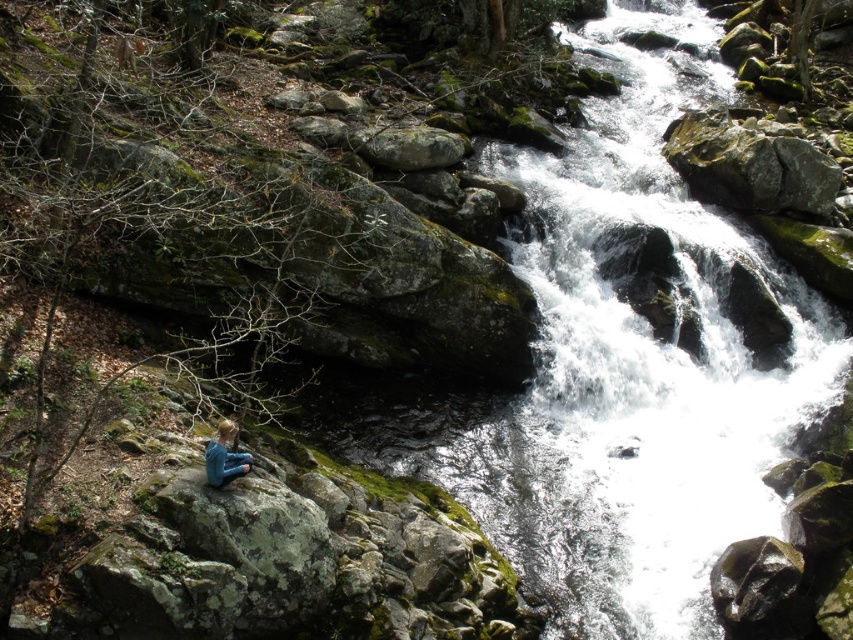
Does point (708, 547) lie behind point (219, 465)?

Yes, it is.

Is green mossy rock at center shorter than blue fabric person at lower left?

No.

What are the coordinates of `green mossy rock at center` in the screenshot? It's located at (614, 369).

Locate an element on the screen. green mossy rock at center is located at coordinates (614, 369).